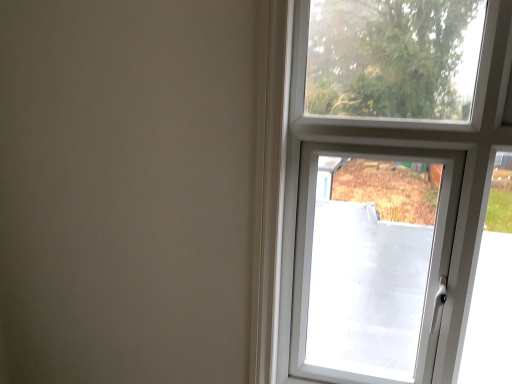
This screenshot has height=384, width=512. Identify the location of clear glass window at upper right. (380, 149).

Describe the element at coordinates (380, 149) in the screenshot. I see `clear glass window at upper right` at that location.

Measure the distance between point (284, 113) and camera.

Point (284, 113) and camera are 3.85 feet apart.

Locate an element on the screen. The height and width of the screenshot is (384, 512). clear glass window at upper right is located at coordinates (380, 149).